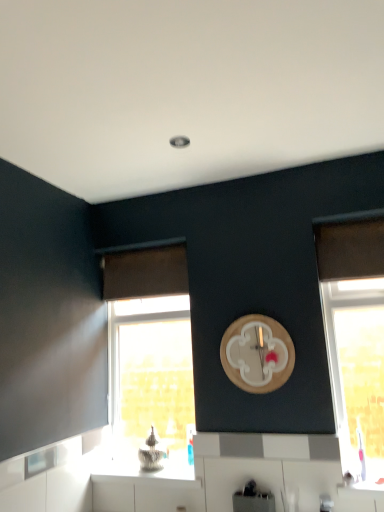
Question: In terms of height, does metallic silver toaster at lower center look taller or shorter compared to translucent glass window at right, the first window in the right-to-left sequence?

Choices:
 (A) tall
 (B) short

Answer: (B)

Question: Visually, is metallic silver toaster at lower center positioned to the left or to the right of translucent glass window at right, the 1th window in the front-to-back sequence?

Choices:
 (A) right
 (B) left

Answer: (B)

Question: Estimate the real-world distances between objects in this image. Which object is farther from the white glossy countertop at lower center?

Choices:
 (A) translucent glass window at right, the first window in the right-to-left sequence
 (B) brown fabric curtain at upper left
 (C) metallic silver toaster at lower center
 (D) wooden clock at upper center
 (E) clear glass window at lower left, which appears as the second window when viewed from the right

Answer: (D)

Question: Which object is positioned farthest from the translucent glass window at right, the 1th window in the front-to-back sequence?

Choices:
 (A) metallic silver toaster at lower center
 (B) wooden clock at upper center
 (C) clear glass window at lower left, positioned as the first window in left-to-right order
 (D) brown fabric curtain at upper left
 (E) white glossy countertop at lower center

Answer: (E)